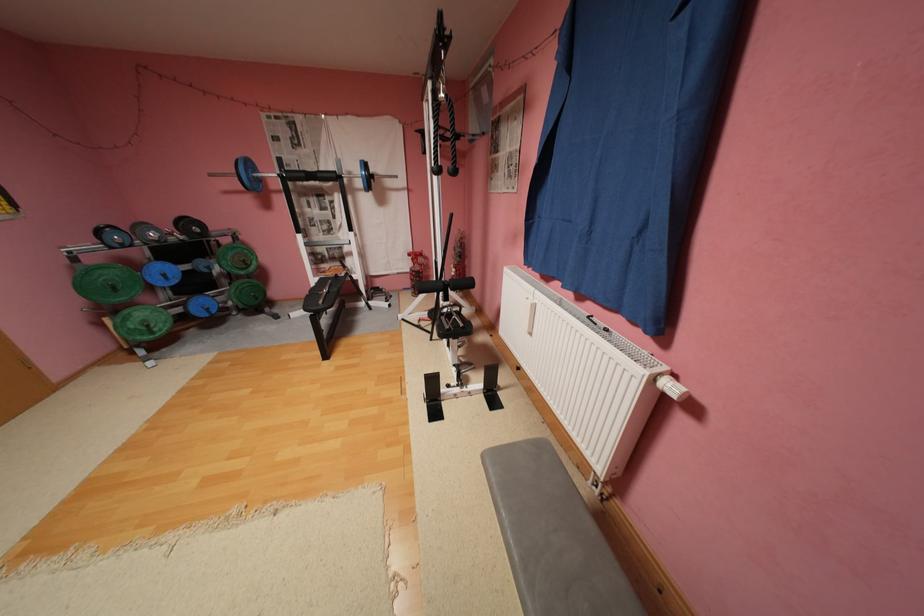
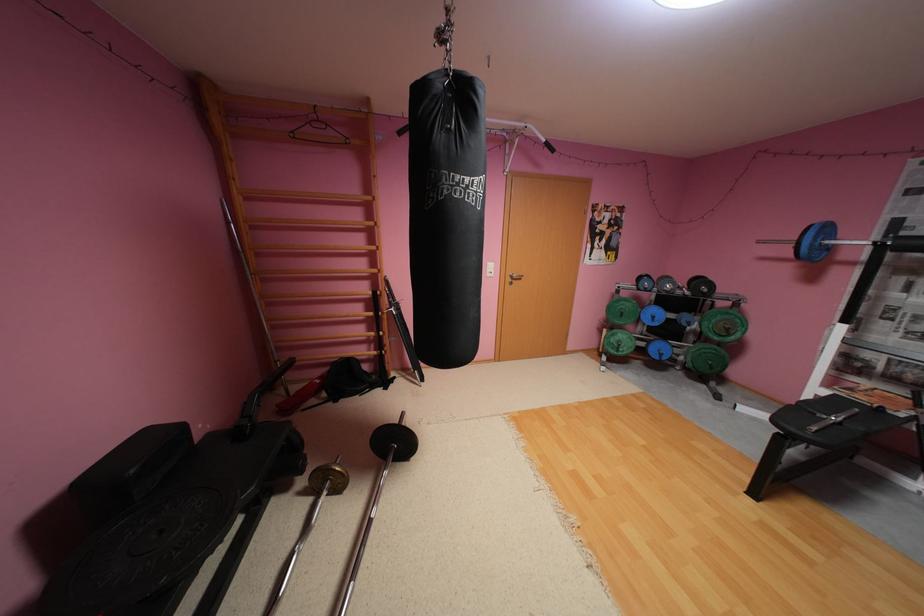
Find the pixel in the second image that matches the point at 258,164 in the first image.

(835, 229)